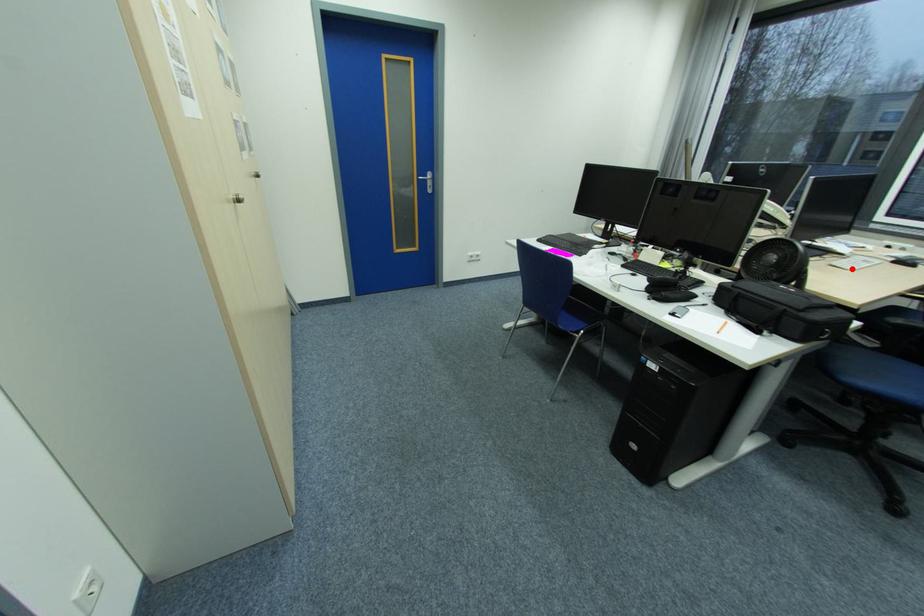
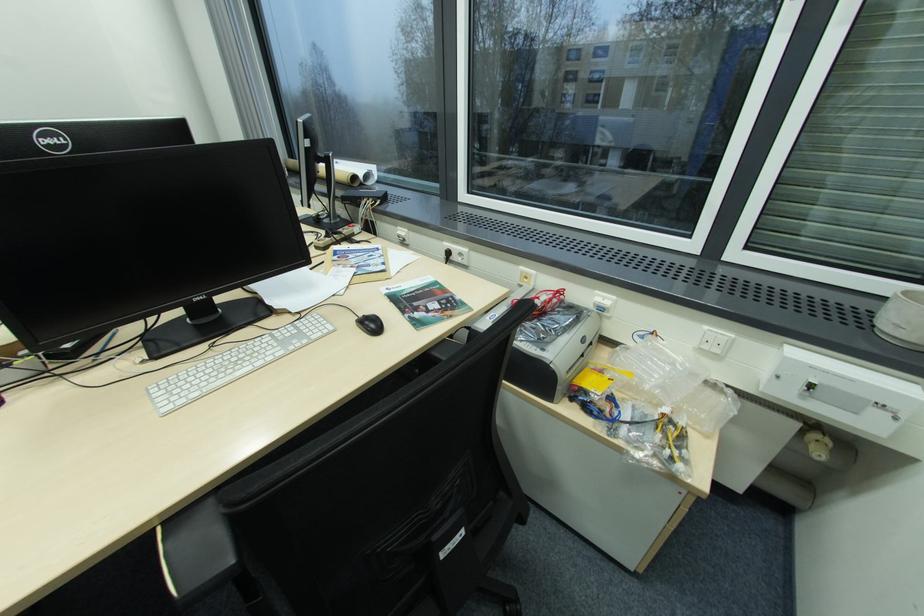
Locate, in the second image, the point that corresponds to the highlighted location in the first image.

(172, 403)